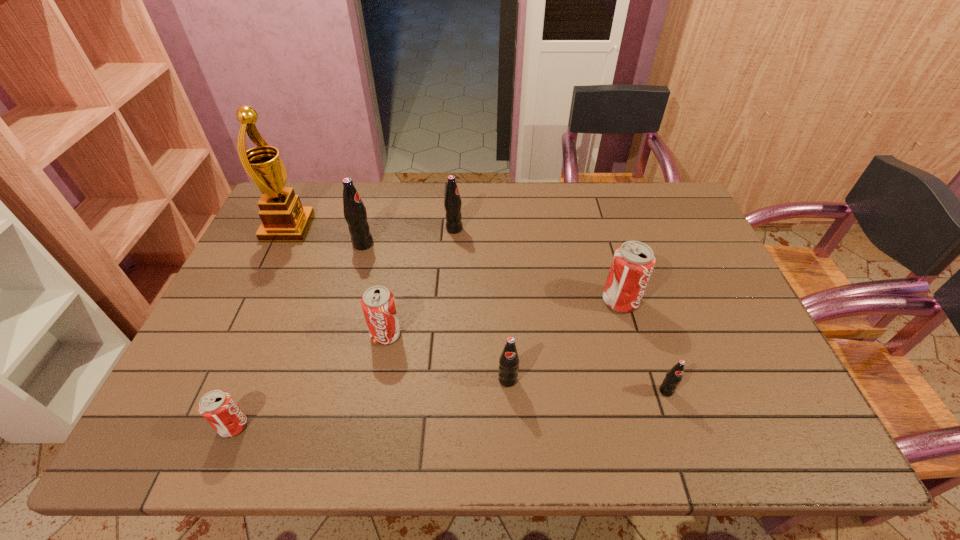
Where is `award`? award is located at coordinates (284, 219).

I want to click on gold award, so click(284, 219).

Where is `the sixth nearest soda can`? This screenshot has height=540, width=960. the sixth nearest soda can is located at coordinates (355, 214).

Image resolution: width=960 pixels, height=540 pixels. What are the coordinates of `the seventh shortest object` in the screenshot? It's located at (355, 214).

The image size is (960, 540). Identify the location of the farthest black pop. (452, 202).

Locate an element on the screen. This screenshot has width=960, height=540. the second black pop from left to right is located at coordinates (452, 202).

Find the location of a particular element. The height and width of the screenshot is (540, 960). the fourth farthest object is located at coordinates (633, 262).

Locate an element on the screen. the rightmost pink soda can is located at coordinates (633, 262).

Locate an element on the screen. the fifth soda can from right to left is located at coordinates 378,304.

Locate an element on the screen. This screenshot has height=540, width=960. the second biggest pink soda can is located at coordinates (378, 304).